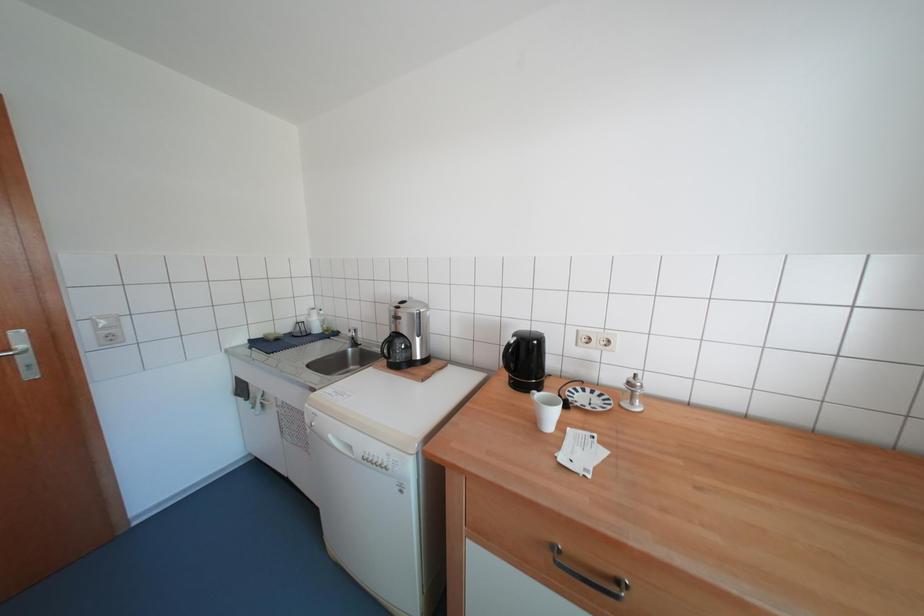
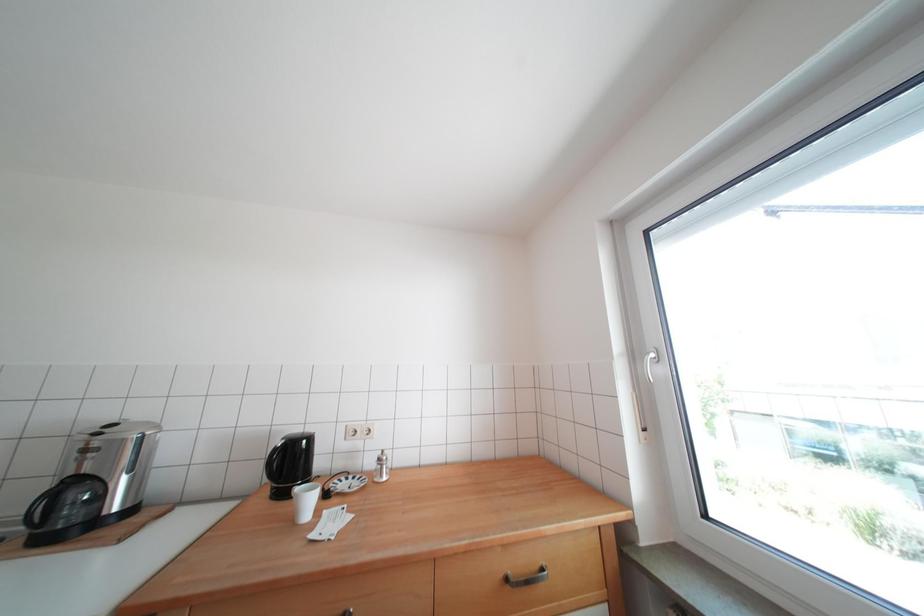
How did the camera likely rotate?

The camera rotated toward right-up.